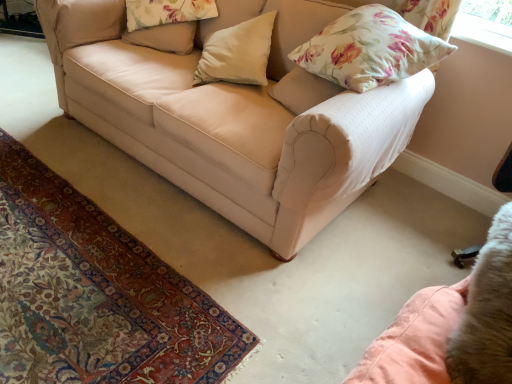
Question: Is white matte pillow at center, marked as the second pillow in a left-to-right arrangement, wider than floral fabric pillow at upper right, which is the first pillow in right-to-left order?

Choices:
 (A) yes
 (B) no

Answer: (A)

Question: Does white matte pillow at center, the 2th pillow from the right, have a smaller size compared to floral fabric pillow at upper right, which is the first pillow in right-to-left order?

Choices:
 (A) yes
 (B) no

Answer: (A)

Question: Considering the relative sizes of white matte pillow at center, the 2th pillow from the right, and floral fabric pillow at upper right, the third pillow from the left, in the image provided, is white matte pillow at center, the 2th pillow from the right, taller than floral fabric pillow at upper right, the third pillow from the left,?

Choices:
 (A) no
 (B) yes

Answer: (B)

Question: Is white matte pillow at center, marked as the second pillow in a left-to-right arrangement, placed right next to floral fabric pillow at upper right, which is the first pillow in right-to-left order?

Choices:
 (A) no
 (B) yes

Answer: (A)

Question: Is white matte pillow at center, the 2th pillow from the right, looking in the opposite direction of floral fabric pillow at upper right, which is the first pillow in right-to-left order?

Choices:
 (A) yes
 (B) no

Answer: (B)

Question: From a real-world perspective, is white matte pillow at center, marked as the second pillow in a left-to-right arrangement, under floral fabric pillow at upper right, the third pillow from the left?

Choices:
 (A) yes
 (B) no

Answer: (A)

Question: Considering the relative sizes of beige fabric pillow at upper center, which ranks as the 1th pillow in left-to-right order, and floral fabric pillow at upper right, which is the first pillow in right-to-left order, in the image provided, is beige fabric pillow at upper center, which ranks as the 1th pillow in left-to-right order, bigger than floral fabric pillow at upper right, which is the first pillow in right-to-left order,?

Choices:
 (A) no
 (B) yes

Answer: (A)

Question: Is beige fabric pillow at upper center, which ranks as the 1th pillow in left-to-right order, oriented away from floral fabric pillow at upper right, which is the first pillow in right-to-left order?

Choices:
 (A) yes
 (B) no

Answer: (B)

Question: Does beige fabric pillow at upper center, positioned as the 3th pillow in right-to-left order, come in front of floral fabric pillow at upper right, which is the first pillow in right-to-left order?

Choices:
 (A) yes
 (B) no

Answer: (B)

Question: Is beige fabric pillow at upper center, which ranks as the 1th pillow in left-to-right order, shorter than floral fabric pillow at upper right, the third pillow from the left?

Choices:
 (A) no
 (B) yes

Answer: (B)

Question: Is floral fabric pillow at upper right, which is the first pillow in right-to-left order, completely or partially inside beige fabric pillow at upper center, positioned as the 3th pillow in right-to-left order?

Choices:
 (A) no
 (B) yes

Answer: (A)

Question: Is beige fabric pillow at upper center, which ranks as the 1th pillow in left-to-right order, to the right of floral fabric pillow at upper right, which is the first pillow in right-to-left order, from the viewer's perspective?

Choices:
 (A) no
 (B) yes

Answer: (A)

Question: Considering the relative sizes of beige fabric couch at center and floral fabric pillow at upper right, which is the first pillow in right-to-left order, in the image provided, is beige fabric couch at center shorter than floral fabric pillow at upper right, which is the first pillow in right-to-left order,?

Choices:
 (A) yes
 (B) no

Answer: (B)